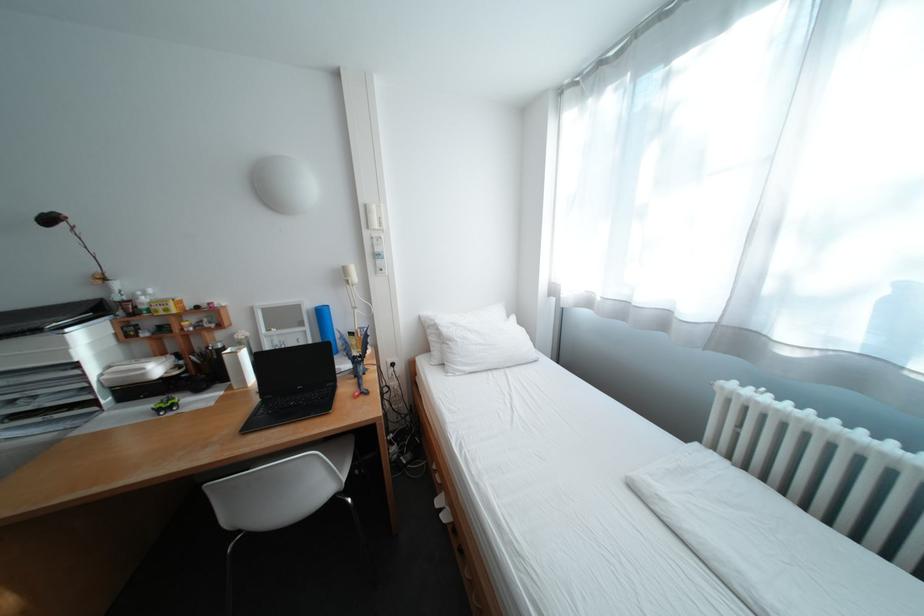
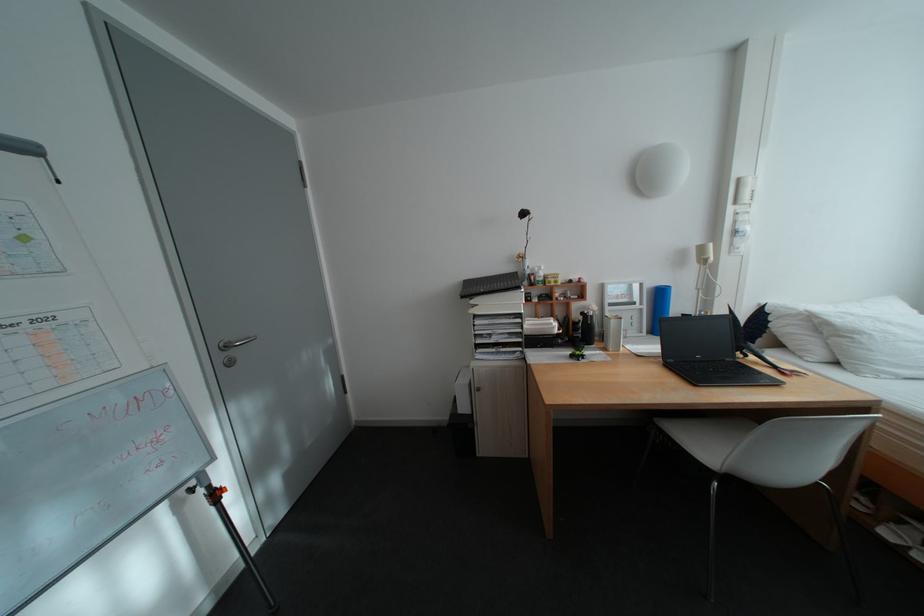
Where in the second image is the point corresponding to point (242, 389) from the first image?

(617, 350)